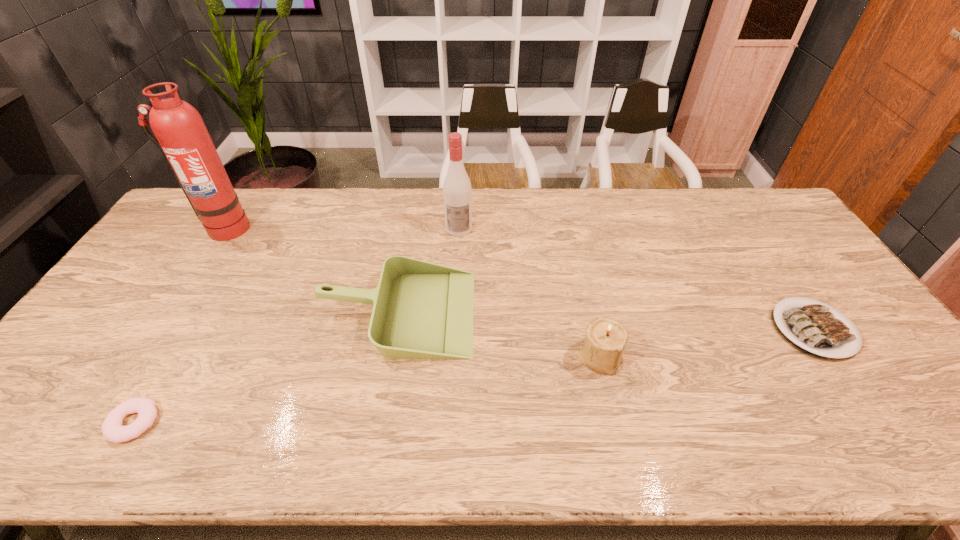
You are a GUI agent. You are given a task and a screenshot of the screen. Output one action in this format:
    pyautogui.click(x=<x>, y=<y>)
    Task: Click on the free space at the near edge
    The width and height of the screenshot is (960, 540).
    Given the screenshot: What is the action you would take?
    pyautogui.click(x=471, y=453)

Find the location of a particular element. vacant space at the far right corner of the desktop is located at coordinates (x=762, y=210).

Where is `free spot between the second tallest object and the doughnut`? free spot between the second tallest object and the doughnut is located at coordinates (297, 326).

Identify the location of empty space between the second tallest object and the nearest object. (x=297, y=326).

Locate an element on the screen. free space between the third tallest object and the nearest object is located at coordinates (367, 389).

What are the coordinates of `vacant space that's between the rightmost object and the tallest object` in the screenshot? It's located at (518, 279).

Where is `free area in between the fifth shortest object and the rightmost object`? Image resolution: width=960 pixels, height=540 pixels. free area in between the fifth shortest object and the rightmost object is located at coordinates (636, 279).

Identify the location of empty space that is in between the alcohol and the fire extinguisher. The height and width of the screenshot is (540, 960). (342, 228).

At what (x,y) coordinates should I click in order to perform the action: click on free space between the nearest object and the plate. Please return your answer as a coordinate pair (x, y). The width and height of the screenshot is (960, 540). Looking at the image, I should click on (474, 376).

You are a GUI agent. You are given a task and a screenshot of the screen. Output one action in this format:
    pyautogui.click(x=<x>, y=<y>)
    Task: Click on the empty space between the alcohol and the candle_holder
    This screenshot has width=960, height=540.
    Given the screenshot: What is the action you would take?
    pyautogui.click(x=529, y=292)